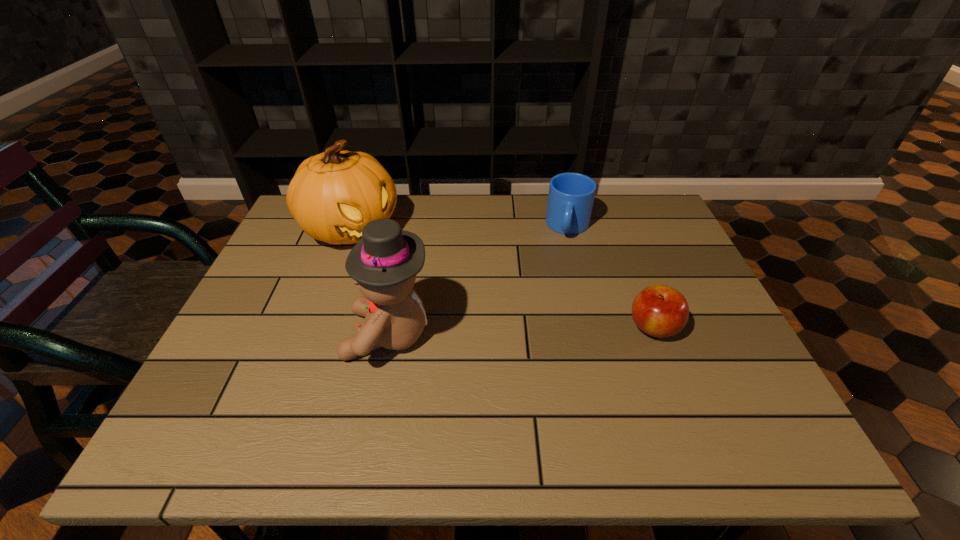
Locate an element on the screen. The image size is (960, 540). rag_doll is located at coordinates tap(384, 263).

Identify the location of the rightmost object. This screenshot has height=540, width=960. (661, 311).

Locate an element on the screen. apple is located at coordinates (661, 311).

Identify the location of the third object from left to right. (571, 195).

Locate an element on the screen. This screenshot has width=960, height=540. mug is located at coordinates (571, 195).

This screenshot has height=540, width=960. In order to click on pumpkin in this screenshot , I will do click(x=333, y=195).

I want to click on free space located on the front-facing side of the rag_doll, so click(228, 335).

Where is `free space located 0.190m on the front-facing side of the rag_doll`? free space located 0.190m on the front-facing side of the rag_doll is located at coordinates (263, 335).

This screenshot has height=540, width=960. Find the location of `vacant space located on the front-facing side of the rag_doll`. vacant space located on the front-facing side of the rag_doll is located at coordinates (289, 335).

Locate an element on the screen. vacant space situated 0.070m on the stem of the rightmost object is located at coordinates (597, 328).